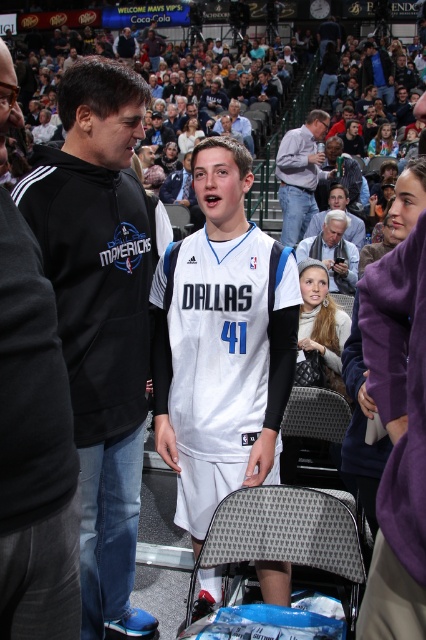
Based on the photo, you are a photographer at the basketball game and want to capture a photo of the white hair at upper center and dark blue hoodie at upper left. Which object should you focus on first if you want to include both in the frame without moving the camera?

You should focus on the white hair at upper center first because it is shorter than the dark blue hoodie at upper left, allowing you to frame both by adjusting the angle slightly upwards to include the taller dark blue hoodie at upper left.

You are standing in the basketball arena and want to reach the point marked as point [233,112]. If your walking speed is 1.5 meters per second, how many seconds will it take you to reach that point?

The point [233,112] is 16.97 meters away from the viewer. At a walking speed of 1.5 meters per second, it would take approximately 11.3 seconds to reach the point.